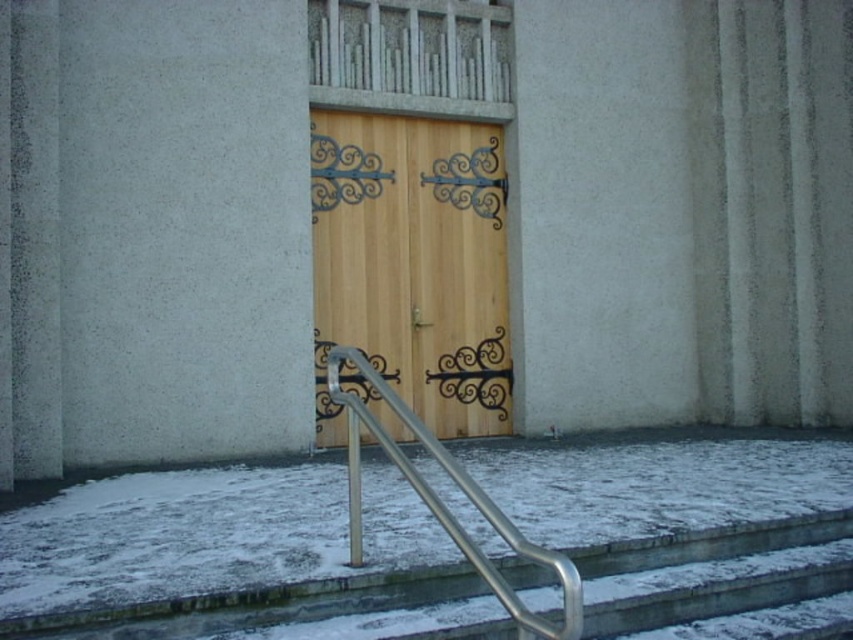
How distant is white powdery snow at lower center from wooden door at center?

white powdery snow at lower center and wooden door at center are 4.20 meters apart from each other.

Between white powdery snow at lower center and wooden door at center, which one is positioned lower?

white powdery snow at lower center

The image size is (853, 640). I want to click on white powdery snow at lower center, so click(236, 561).

Looking at this image, who is positioned more to the right, wooden door at center or silver metallic handrail at lower center?

From the viewer's perspective, silver metallic handrail at lower center appears more on the right side.

Does wooden door at center have a smaller size compared to silver metallic handrail at lower center?

No.

The image size is (853, 640). I want to click on wooden door at center, so click(x=412, y=266).

You are a GUI agent. You are given a task and a screenshot of the screen. Output one action in this format:
    pyautogui.click(x=<x>, y=<y>)
    Task: Click on the wooden door at center
    
    Given the screenshot: What is the action you would take?
    pyautogui.click(x=412, y=266)

Does white powdery snow at lower center have a greater width compared to silver metallic handrail at lower center?

Yes, white powdery snow at lower center is wider than silver metallic handrail at lower center.

Who is more distant from viewer, (x=718, y=582) or (x=437, y=497)?

Point (x=437, y=497)

Between point (68, 563) and point (347, 400), which one is positioned in front?

Positioned in front is point (68, 563).

You are a GUI agent. You are given a task and a screenshot of the screen. Output one action in this format:
    pyautogui.click(x=<x>, y=<y>)
    Task: Click on the white powdery snow at lower center
    
    Given the screenshot: What is the action you would take?
    pyautogui.click(x=236, y=561)